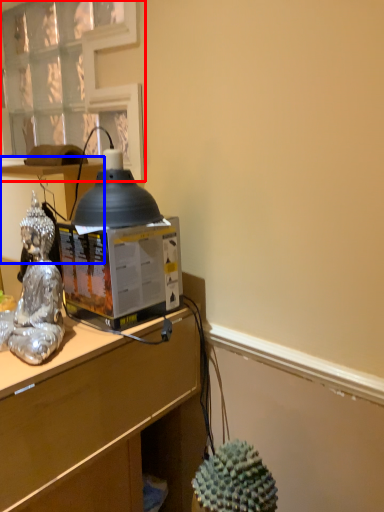
Question: Which of the following is the closest to the observer, window (highlighted by a red box) or vanity (highlighted by a blue box)?

Choices:
 (A) window
 (B) vanity

Answer: (B)